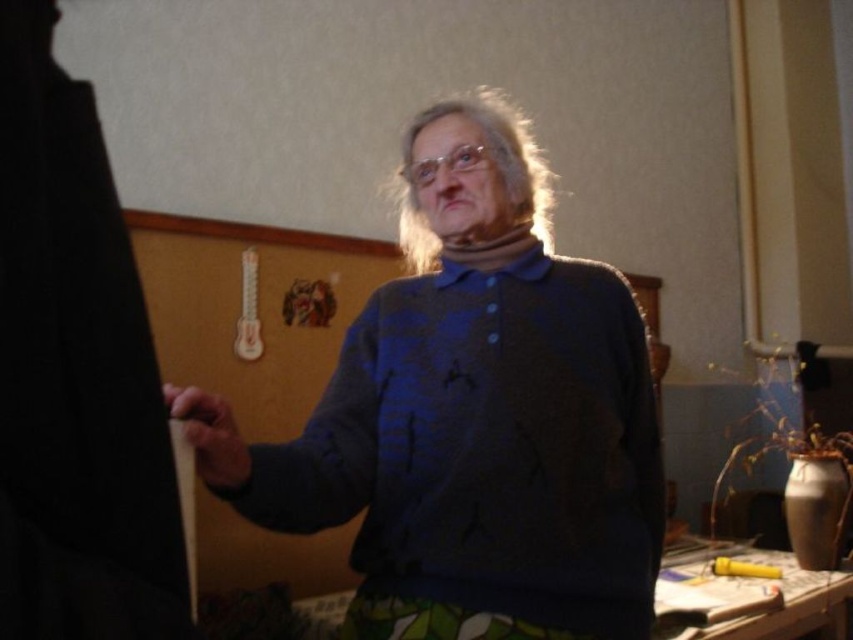
Question: Which of the following is the closest to the observer?

Choices:
 (A) blue knitted sweater at center
 (B) smooth wooden pencil at left

Answer: (B)

Question: Can you confirm if blue knitted sweater at center is positioned to the right of smooth wooden pencil at left?

Choices:
 (A) yes
 (B) no

Answer: (A)

Question: Does blue knitted sweater at center have a lesser width compared to smooth wooden pencil at left?

Choices:
 (A) no
 (B) yes

Answer: (A)

Question: Is blue knitted sweater at center above smooth wooden pencil at left?

Choices:
 (A) yes
 (B) no

Answer: (A)

Question: Which of the following is the farthest from the observer?

Choices:
 (A) (585, 522)
 (B) (219, 410)

Answer: (A)